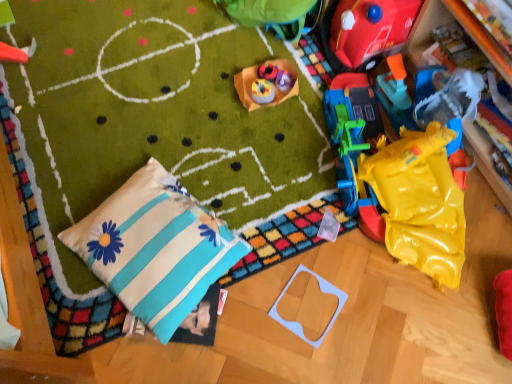
Question: Can you confirm if matte plastic toy at center, which is the fifth toy from top to bottom, is thinner than rubberized red toy at upper left, the third toy in the top-to-bottom sequence?

Choices:
 (A) yes
 (B) no

Answer: (A)

Question: Does matte plastic toy at center, which is the fifth toy from top to bottom, appear on the left side of rubberized red toy at upper left, which appears as the first toy when viewed from the left?

Choices:
 (A) no
 (B) yes

Answer: (A)

Question: Considering the relative positions of matte plastic toy at center, the 2th toy ordered from the bottom, and rubberized red toy at upper left, the third toy in the top-to-bottom sequence, in the image provided, is matte plastic toy at center, the 2th toy ordered from the bottom, to the right of rubberized red toy at upper left, the third toy in the top-to-bottom sequence, from the viewer's perspective?

Choices:
 (A) no
 (B) yes

Answer: (B)

Question: Does matte plastic toy at center, the 2th toy ordered from the bottom, have a greater width compared to rubberized red toy at upper left, the third toy in the top-to-bottom sequence?

Choices:
 (A) yes
 (B) no

Answer: (B)

Question: From the image's perspective, relative to rubberized red toy at upper left, the third toy in the top-to-bottom sequence, is rubberized red car at upper right, which ranks as the sixth toy in left-to-right order, above or below?

Choices:
 (A) above
 (B) below

Answer: (A)

Question: Based on their sizes in the image, would you say rubberized red car at upper right, which is the fifth toy in bottom-to-top order, is bigger or smaller than rubberized red toy at upper left, which appears as the first toy when viewed from the left?

Choices:
 (A) small
 (B) big

Answer: (B)

Question: In terms of height, does rubberized red car at upper right, which is the 2th toy from top to bottom, look taller or shorter compared to rubberized red toy at upper left, which appears as the first toy when viewed from the left?

Choices:
 (A) tall
 (B) short

Answer: (A)

Question: Is point (387, 23) closer or farther from the camera than point (14, 51)?

Choices:
 (A) farther
 (B) closer

Answer: (B)

Question: In the image, is cotton/pillow at lower left on the left side or the right side of yellow rubber at right?

Choices:
 (A) right
 (B) left

Answer: (B)

Question: From their relative heights in the image, would you say cotton/pillow at lower left is taller or shorter than yellow rubber at right?

Choices:
 (A) tall
 (B) short

Answer: (B)

Question: From the image's perspective, is cotton/pillow at lower left above or below yellow rubber at right?

Choices:
 (A) above
 (B) below

Answer: (B)

Question: Is cotton/pillow at lower left in front of or behind yellow rubber at right in the image?

Choices:
 (A) front
 (B) behind

Answer: (A)

Question: Looking at the image, does rubberized red toy at upper left, which ranks as the sixth toy in right-to-left order, seem bigger or smaller compared to matte plastic toy at center, the 2th toy ordered from the bottom?

Choices:
 (A) small
 (B) big

Answer: (B)

Question: Considering the positions of rubberized red toy at upper left, the third toy in the top-to-bottom sequence, and matte plastic toy at center, the 2th toy ordered from the bottom, in the image, is rubberized red toy at upper left, the third toy in the top-to-bottom sequence, taller or shorter than matte plastic toy at center, the 2th toy ordered from the bottom,?

Choices:
 (A) short
 (B) tall

Answer: (B)